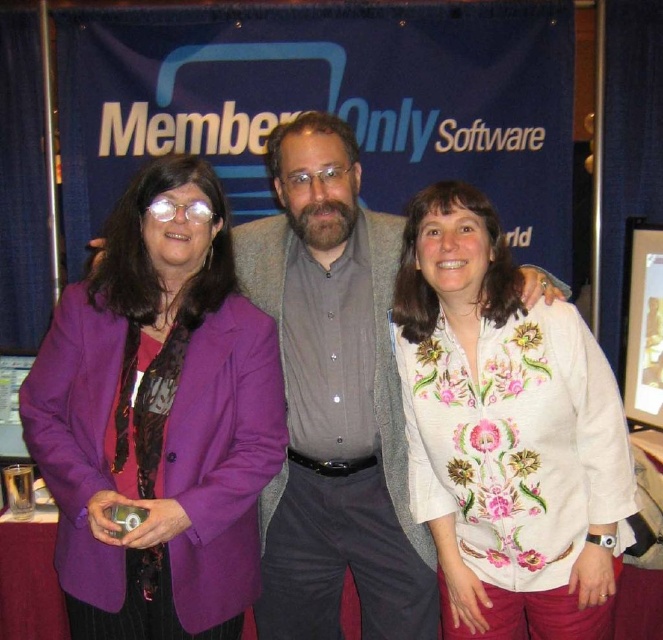
Question: Which point is farther to the camera?

Choices:
 (A) gray textured sweater at center
 (B) purple fabric jacket at left
 (C) white floral blouse at center

Answer: (A)

Question: Which object is closer to the camera taking this photo?

Choices:
 (A) gray textured sweater at center
 (B) white floral blouse at center
 (C) purple fabric jacket at left

Answer: (C)

Question: Does white floral blouse at center have a smaller size compared to gray textured sweater at center?

Choices:
 (A) no
 (B) yes

Answer: (B)

Question: Can you confirm if white floral blouse at center is bigger than gray textured sweater at center?

Choices:
 (A) no
 (B) yes

Answer: (A)

Question: Is purple fabric jacket at left thinner than white floral blouse at center?

Choices:
 (A) yes
 (B) no

Answer: (B)

Question: Estimate the real-world distances between objects in this image. Which object is closer to the purple fabric jacket at left?

Choices:
 (A) gray textured sweater at center
 (B) white floral blouse at center

Answer: (A)